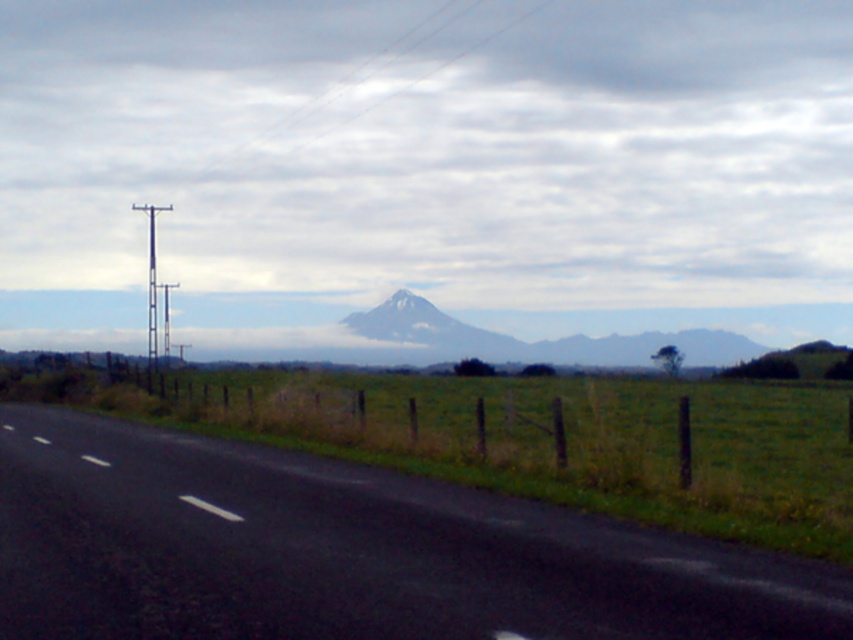
Question: Which of the following is the closest to the observer?

Choices:
 (A) (635, 49)
 (B) (728, 612)

Answer: (B)

Question: Can you confirm if cloudy sky at upper center is smaller than black asphalt road at center?

Choices:
 (A) no
 (B) yes

Answer: (A)

Question: Which point appears closest to the camera in this image?

Choices:
 (A) (453, 596)
 (B) (85, 72)

Answer: (A)

Question: Does cloudy sky at upper center have a lesser width compared to black asphalt road at center?

Choices:
 (A) no
 (B) yes

Answer: (A)

Question: Where is cloudy sky at upper center located in relation to black asphalt road at center in the image?

Choices:
 (A) below
 (B) above

Answer: (B)